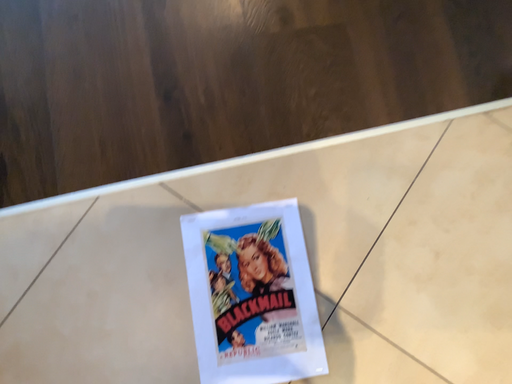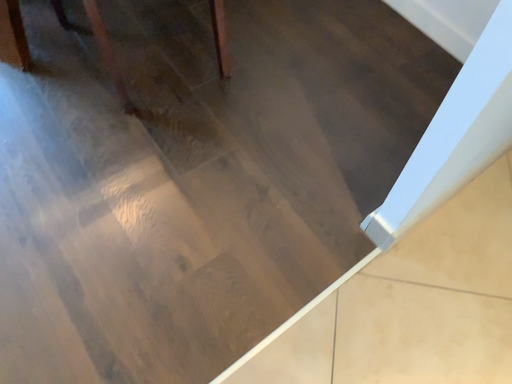
Question: Which way did the camera rotate in the video?

Choices:
 (A) rotated upward
 (B) rotated downward

Answer: (A)